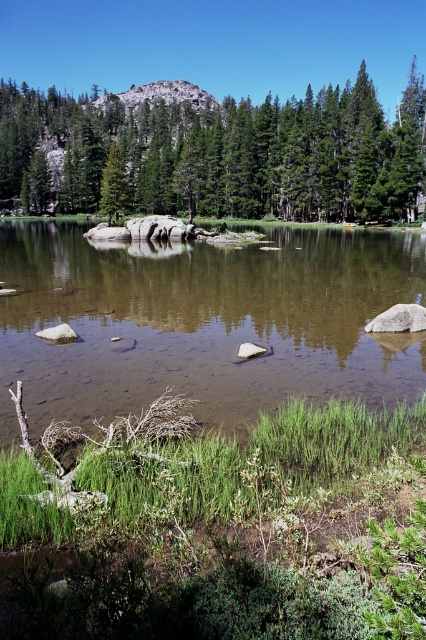
You are standing at the edge of the water and want to take a photo of both the brown smooth water at center and the green matte tree at center. Which object should you focus on first to ensure both are in clear view?

You should focus on the brown smooth water at center first because it is closer to you than the green matte tree at center, ensuring both will be in focus when focused on the closer object.

Consider the image. You are a surveyor measuring distances in the landscape. You have a measuring tape that can extend up to 70 meters. You need to measure the distance between the brown smooth water at center and the green matte tree at upper center. Can your measuring tape reach that distance?

The brown smooth water at center is 70.85 meters from the green matte tree at upper center. Since the measuring tape can only extend up to 70 meters, it cannot reach the full distance between them.

You are an artist trying to paint the scene. You want to ensure the brown smooth water at center and the green matte tree at center are proportionally accurate. Which object should you paint larger?

The brown smooth water at center should be painted larger since it has a larger size compared to the green matte tree at center according to the description.